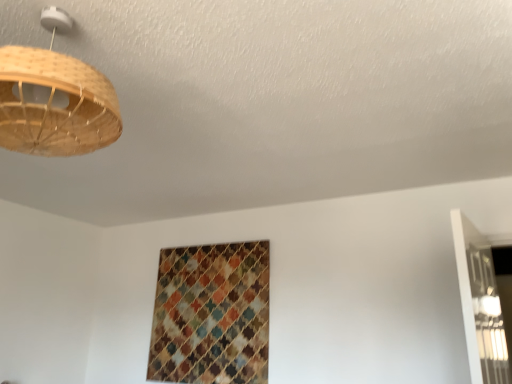
Question: From a real-world perspective, is natural wood lampshade at upper left above or below textured woven pattern at center?

Choices:
 (A) above
 (B) below

Answer: (A)

Question: In terms of width, does natural wood lampshade at upper left look wider or thinner when compared to textured woven pattern at center?

Choices:
 (A) thin
 (B) wide

Answer: (B)

Question: Considering the positions of point (109, 139) and point (158, 352), is point (109, 139) closer or farther from the camera than point (158, 352)?

Choices:
 (A) farther
 (B) closer

Answer: (B)

Question: Based on their positions, is textured woven pattern at center located to the left or right of natural wood lampshade at upper left?

Choices:
 (A) left
 (B) right

Answer: (B)

Question: In terms of width, does textured woven pattern at center look wider or thinner when compared to natural wood lampshade at upper left?

Choices:
 (A) wide
 (B) thin

Answer: (B)

Question: In terms of height, does textured woven pattern at center look taller or shorter compared to natural wood lampshade at upper left?

Choices:
 (A) tall
 (B) short

Answer: (A)

Question: From a real-world perspective, is textured woven pattern at center positioned above or below natural wood lampshade at upper left?

Choices:
 (A) below
 (B) above

Answer: (A)